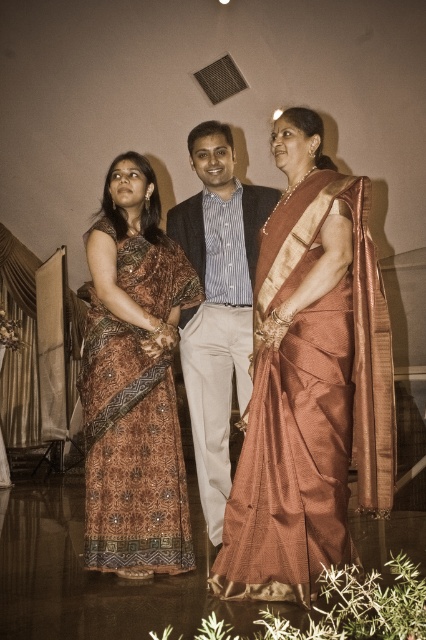
You are a photographer at the event and want to capture a group photo where both the shiny gold saree at center and the brown printed saree at left are clearly visible. Considering their widths, which saree might require more space in the frame to ensure it is fully visible?

The shiny gold saree at center might require more space in the frame because it is wider than the brown printed saree at left according to the description.

You are a photographer at the event and need to ensure both the shiny gold saree at center and the silk shirt at center are visible in the photo. Given their sizes, which one might require more space in the frame to capture fully?

The shiny gold saree at center has a larger size compared to the silk shirt at center, so it would require more space in the frame to ensure it is fully captured.

You are a photographer at a formal event. You need to capture a photo that includes both the shiny gold saree at center and the silk shirt at center. Based on their positions, which one should you adjust your camera angle to focus on first to ensure both are in frame?

The shiny gold saree at center is positioned on the right side of the silk shirt at center. To include both in the frame, adjust the camera angle to focus on the silk shirt at center first, then pan slightly to the right to include the shiny gold saree at center.